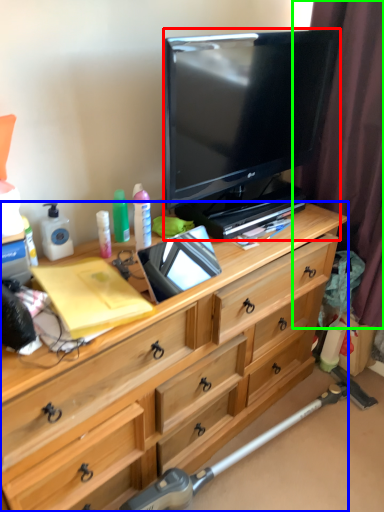
Question: Which object is the farthest from television (highlighted by a red box)? Choose among these: desk (highlighted by a blue box) or curtain (highlighted by a green box).

Choices:
 (A) desk
 (B) curtain

Answer: (A)